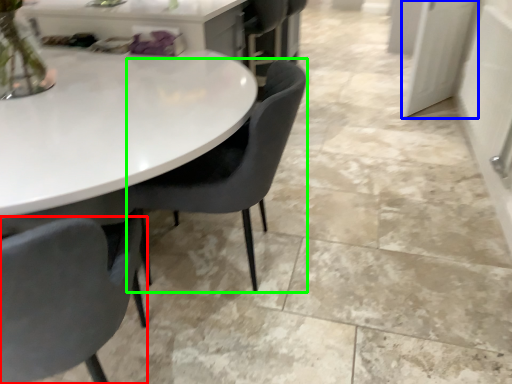
Question: Which object is the closest to the chair (highlighted by a red box)? Choose among these: glass door (highlighted by a blue box) or chair (highlighted by a green box).

Choices:
 (A) glass door
 (B) chair

Answer: (B)